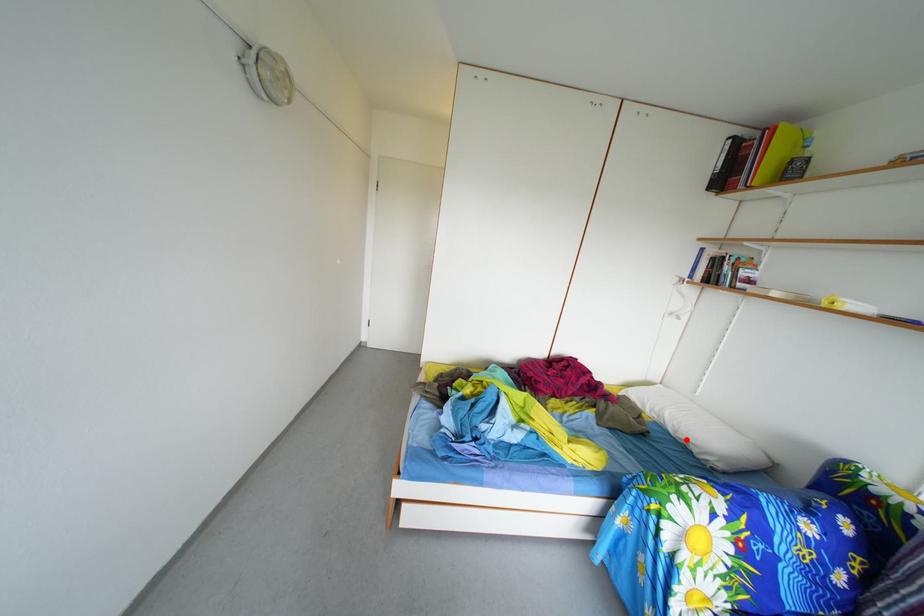
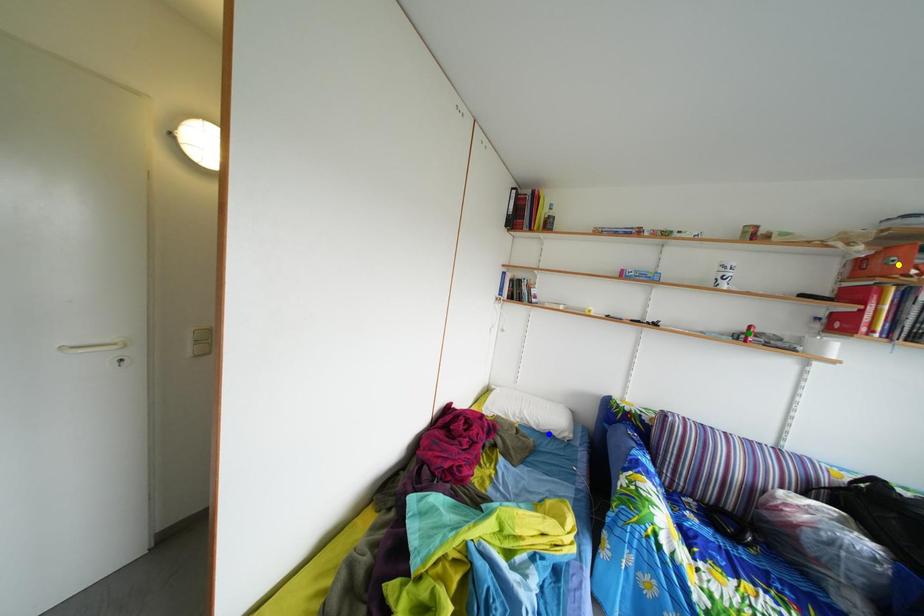
Question: I am providing you with two images of the same scene from different viewpoints. A red point is marked on the first image. You are given multiple points on the second image. Which point in image 2 is actually the same real-world point as the red point in image 1?

Choices:
 (A) green point
 (B) yellow point
 (C) blue point

Answer: (C)